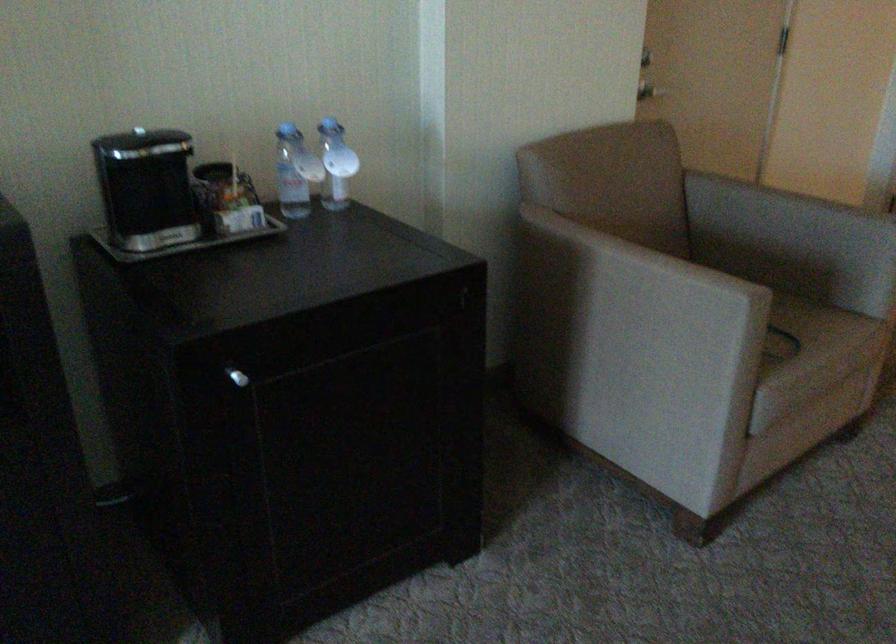
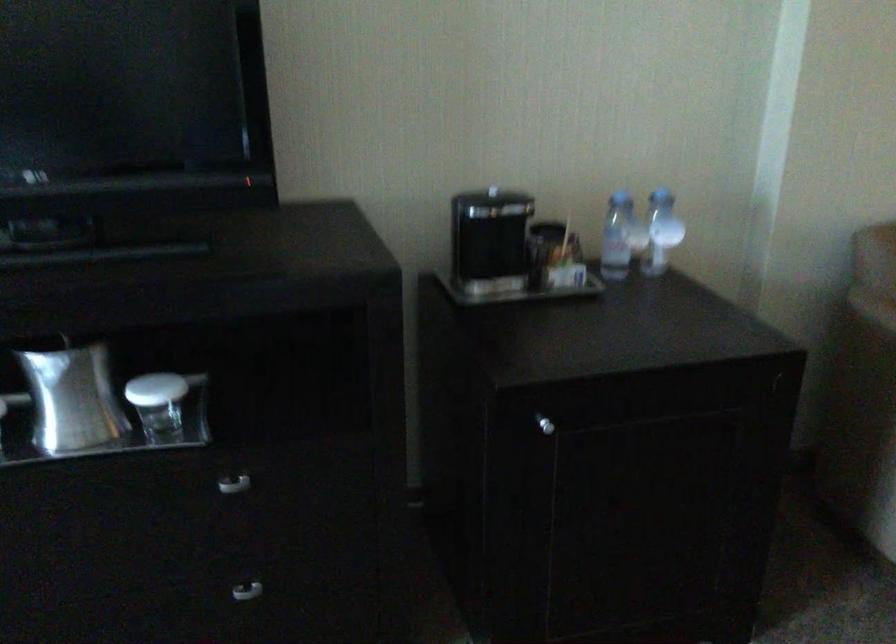
Question: The images are taken continuously from a first-person perspective. In which direction are you moving?

Choices:
 (A) Left
 (B) Right
 (C) Forward
 (D) Backward

Answer: (D)